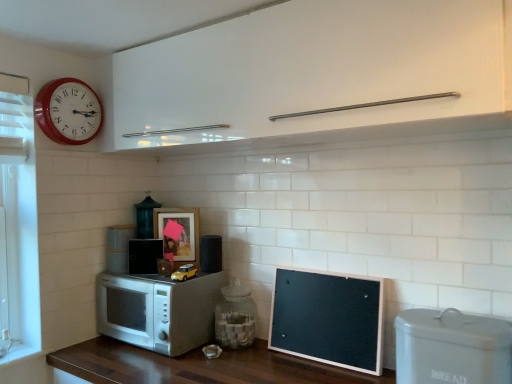
What are the coordinates of `vacant position to the left of yellow matte toy car at center, which is the 5th appliance in back-to-front order` in the screenshot? It's located at (147, 283).